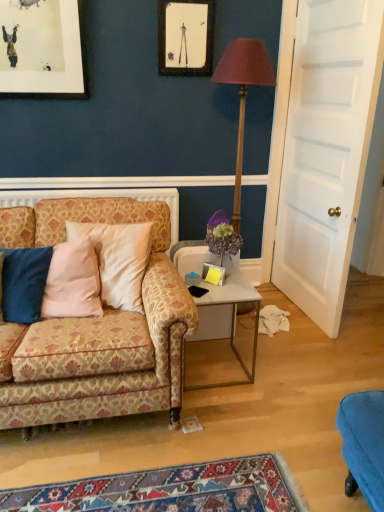
This screenshot has height=512, width=384. I want to click on free spot above white glossy side table at center (from a real-world perspective), so click(209, 284).